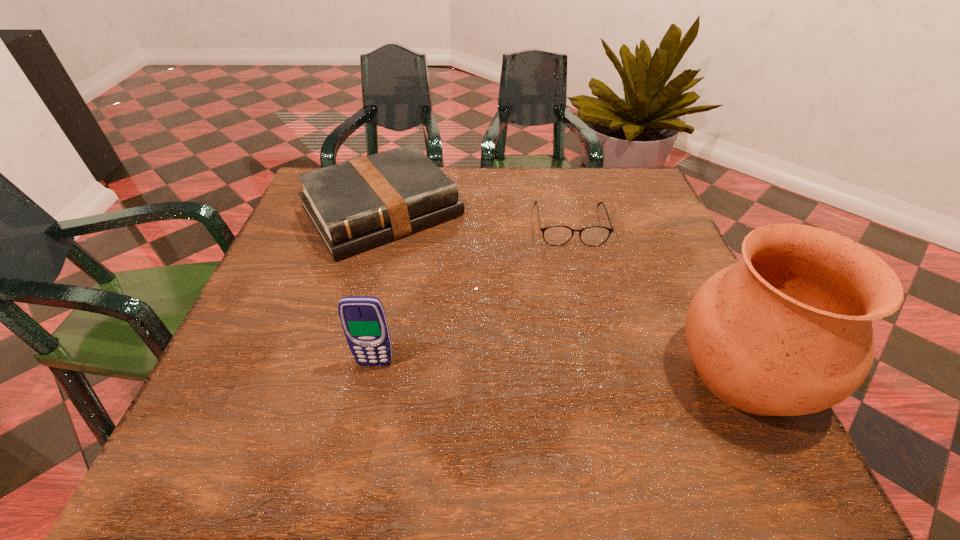
Where is `object that is at the far right corner`? object that is at the far right corner is located at coordinates (556, 235).

In order to click on object located at the near right corner in this screenshot , I will do `click(787, 331)`.

You are a GUI agent. You are given a task and a screenshot of the screen. Output one action in this format:
    pyautogui.click(x=<x>, y=<y>)
    Task: Click on the free location at the far edge
    The height and width of the screenshot is (540, 960).
    Given the screenshot: What is the action you would take?
    pyautogui.click(x=470, y=202)

Identify the location of vacant space at the near edge. This screenshot has height=540, width=960. (443, 383).

In the image, there is a desktop. Where is `free space at the left edge`? free space at the left edge is located at coordinates (303, 242).

You are a GUI agent. You are given a task and a screenshot of the screen. Output one action in this format:
    pyautogui.click(x=<x>, y=<y>)
    Task: Click on the blank area at the right edge
    
    Given the screenshot: What is the action you would take?
    pyautogui.click(x=636, y=299)

The width and height of the screenshot is (960, 540). I want to click on free space at the near left corner, so click(271, 381).

The width and height of the screenshot is (960, 540). In the image, there is a desktop. Find the location of `vacant space at the far right corner`. vacant space at the far right corner is located at coordinates pos(602,178).

I want to click on unoccupied area between the rightmost object and the hardback book, so click(564, 292).

Identify the location of vacant point located between the cellular telephone and the shortest object. (472, 294).